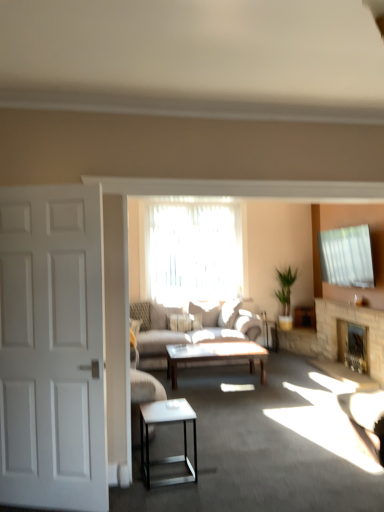
Find the location of a particular element. The image size is (384, 512). translucent fabric at center is located at coordinates (192, 252).

How much space does stone fireplace at center, marked as the first fireplace in a back-to-front arrangement, occupy horizontally?

It is 10.83 inches.

Where is `green leafy plant at center-right`? The height and width of the screenshot is (512, 384). green leafy plant at center-right is located at coordinates (285, 296).

Can we say translucent fabric at center lies outside white matte door at left?

Indeed, translucent fabric at center is completely outside white matte door at left.

Which point is more distant from viewer, (x=219, y=252) or (x=54, y=215)?

The point (x=219, y=252) is farther.

Considering the sizes of objects translucent fabric at center and white matte door at left in the image provided, who is thinner, translucent fabric at center or white matte door at left?

Thinner between the two is translucent fabric at center.

Which of these two, green leafy plant at center-right or wooden polished coffee table at center, is bigger?

green leafy plant at center-right.

From a real-world perspective, is green leafy plant at center-right under wooden polished coffee table at center?

No, from a real-world perspective, green leafy plant at center-right is not below wooden polished coffee table at center.

From the image's perspective, is green leafy plant at center-right on wooden polished coffee table at center?

Indeed, from the image's perspective, green leafy plant at center-right is shown above wooden polished coffee table at center.

Is green leafy plant at center-right in contact with translucent fabric at center?

No.

How many degrees apart are the facing directions of green leafy plant at center-right and translucent fabric at center?

green leafy plant at center-right and translucent fabric at center are facing 0.518 degrees away from each other.

Considering the positions of point (282, 285) and point (240, 212), is point (282, 285) closer or farther from the camera than point (240, 212)?

Point (282, 285) is farther from the camera than point (240, 212).

Could translucent fabric at center be considered to be inside green leafy plant at center-right?

No, green leafy plant at center-right does not contain translucent fabric at center.

How different are the orientations of white glossy side table at lower center and stone fireplace at center, the first fireplace from the front, in degrees?

There is a 177-degree angle between the facing directions of white glossy side table at lower center and stone fireplace at center, the first fireplace from the front.

Are white glossy side table at lower center and stone fireplace at center, the second fireplace from the back, making contact?

No, white glossy side table at lower center is not making contact with stone fireplace at center, the second fireplace from the back.

Considering the points (144, 411) and (324, 352), which point is behind, point (144, 411) or point (324, 352)?

The point (324, 352) is behind.

Can you confirm if white glossy side table at lower center is positioned to the right of stone fireplace at center, the second fireplace from the back?

No.

From the image's perspective, between white matte door at left and stone fireplace at center, marked as the first fireplace in a back-to-front arrangement, which one is located above?

white matte door at left appears higher in the image.

From a real-world perspective, which object stands above the other?

white matte door at left, from a real-world perspective.

The height and width of the screenshot is (512, 384). I want to click on door above the stone fireplace at center, the second fireplace in the front-to-back sequence (from the image's perspective), so click(52, 349).

Is white matte door at left wider or thinner than stone fireplace at center, the second fireplace in the front-to-back sequence?

In the image, white matte door at left appears to be more narrow than stone fireplace at center, the second fireplace in the front-to-back sequence.

Can you confirm if stone fireplace at center, marked as the first fireplace in a back-to-front arrangement, is shorter than green leafy plant at center-right?

Yes, stone fireplace at center, marked as the first fireplace in a back-to-front arrangement, is shorter than green leafy plant at center-right.

Is stone fireplace at center, marked as the first fireplace in a back-to-front arrangement, turned away from green leafy plant at center-right?

That's not correct — stone fireplace at center, marked as the first fireplace in a back-to-front arrangement, is not looking away from green leafy plant at center-right.

Are stone fireplace at center, marked as the first fireplace in a back-to-front arrangement, and green leafy plant at center-right located far from each other?

Yes, stone fireplace at center, marked as the first fireplace in a back-to-front arrangement, and green leafy plant at center-right are located far from each other.

Between stone fireplace at center, the second fireplace in the front-to-back sequence, and green leafy plant at center-right, which one appears on the left side from the viewer's perspective?

From the viewer's perspective, green leafy plant at center-right appears more on the left side.

Based on the photo, is white glossy side table at lower center bigger or smaller than light gray fabric couch at center?

Considering their sizes, white glossy side table at lower center takes up less space than light gray fabric couch at center.

Is point (141, 414) more distant than point (147, 352)?

No.

From a real-world perspective, between white glossy side table at lower center and light gray fabric couch at center, who is vertically higher?

light gray fabric couch at center, from a real-world perspective.

Image resolution: width=384 pixels, height=512 pixels. Find the location of `door on the left of the translucent fabric at center`. door on the left of the translucent fabric at center is located at coordinates (52, 349).

You are a GUI agent. You are given a task and a screenshot of the screen. Output one action in this format:
    pyautogui.click(x=<x>, y=<y>)
    Task: Click on the houseplant lying behind the wooden polished coffee table at center
    
    Given the screenshot: What is the action you would take?
    pyautogui.click(x=285, y=296)

When comparing their distances from stone fireplace at center, the first fireplace from the front, does green leafy plant at center-right or white glossy side table at lower center seem closer?

green leafy plant at center-right.

Looking at the image, which one is located closer to stone fireplace at center, the second fireplace in the front-to-back sequence, white matte door at left or translucent fabric at center?

The object closer to stone fireplace at center, the second fireplace in the front-to-back sequence, is translucent fabric at center.

Estimate the real-world distances between objects in this image. Which object is closer to wooden polished coffee table at center, green leafy plant at center-right or white matte door at left?

green leafy plant at center-right.

Looking at the image, which one is located further to green leafy plant at center-right, white matte door at left or white glossy side table at lower center?

white matte door at left lies further to green leafy plant at center-right than the other object.

Based on their spatial positions, is stone fireplace at center, the first fireplace from the front, or light gray fabric couch at center further from wooden polished coffee table at center?

Among the two, stone fireplace at center, the first fireplace from the front, is located further to wooden polished coffee table at center.

From the image, which object appears to be nearer to wooden polished coffee table at center, stone fireplace at center, the second fireplace in the front-to-back sequence, or white glossy side table at lower center?

Among the two, white glossy side table at lower center is located nearer to wooden polished coffee table at center.

Based on their spatial positions, is stone fireplace at center, the second fireplace from the back, or stone fireplace at center, marked as the first fireplace in a back-to-front arrangement, further from wooden polished coffee table at center?

The object further to wooden polished coffee table at center is stone fireplace at center, marked as the first fireplace in a back-to-front arrangement.

Considering their positions, is green leafy plant at center-right positioned closer to stone fireplace at center, marked as the first fireplace in a back-to-front arrangement, than wooden polished coffee table at center?

green leafy plant at center-right is closer to stone fireplace at center, marked as the first fireplace in a back-to-front arrangement.

At what (x,y) coordinates should I click in order to perform the action: click on houseplant located between wooden polished coffee table at center and translucent fabric at center in the depth direction. Please return your answer as a coordinate pair (x, y). Looking at the image, I should click on (285, 296).

You are a GUI agent. You are given a task and a screenshot of the screen. Output one action in this format:
    pyautogui.click(x=<x>, y=<y>)
    Task: Click on the coffee table between white matte door at left and green leafy plant at center-right in the front-back direction
    
    Given the screenshot: What is the action you would take?
    pyautogui.click(x=215, y=356)

Where is `studio couch positioned between white glossy side table at lower center and translucent fabric at center from near to far`? This screenshot has height=512, width=384. studio couch positioned between white glossy side table at lower center and translucent fabric at center from near to far is located at coordinates (183, 332).

Locate an element on the screen. This screenshot has height=512, width=384. houseplant between stone fireplace at center, the second fireplace from the back, and translucent fabric at center, along the z-axis is located at coordinates (285, 296).